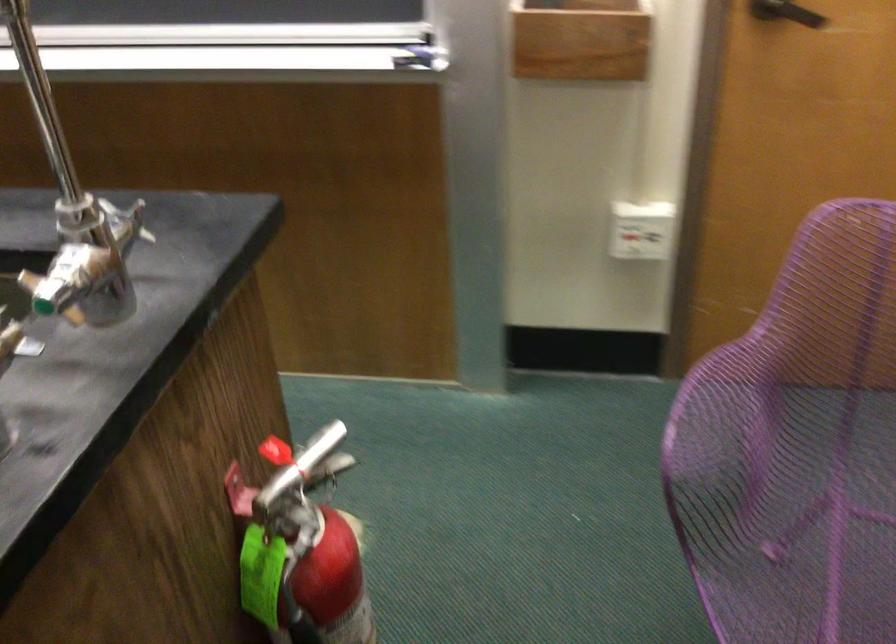
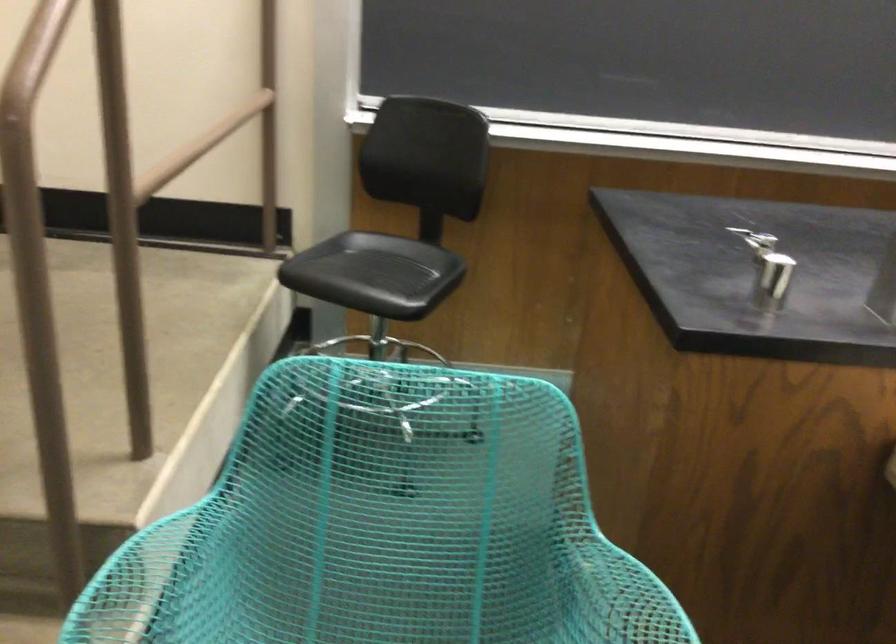
Question: What movement of the cameraman would produce the second image?

Choices:
 (A) Left
 (B) Right
 (C) Forward
 (D) Backward

Answer: (A)